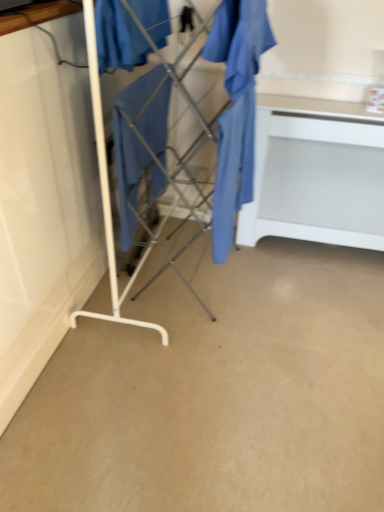
Question: Is the position of white matte table at center more distant than that of metal drying rack at center?

Choices:
 (A) no
 (B) yes

Answer: (B)

Question: Is white matte table at center facing away from metal drying rack at center?

Choices:
 (A) yes
 (B) no

Answer: (B)

Question: Considering the relative positions of white matte table at center and metal drying rack at center in the image provided, is white matte table at center in front of metal drying rack at center?

Choices:
 (A) no
 (B) yes

Answer: (A)

Question: Is white matte table at center wider than metal drying rack at center?

Choices:
 (A) yes
 (B) no

Answer: (B)

Question: From the image's perspective, is white matte table at center over metal drying rack at center?

Choices:
 (A) no
 (B) yes

Answer: (A)

Question: Considering the positions of white matte table at center and matte blue fabric at center, arranged as the 3th clothing when viewed from the right, in the image, is white matte table at center taller or shorter than matte blue fabric at center, arranged as the 3th clothing when viewed from the right,?

Choices:
 (A) short
 (B) tall

Answer: (B)

Question: Considering the positions of point (266, 99) and point (102, 23), is point (266, 99) closer or farther from the camera than point (102, 23)?

Choices:
 (A) closer
 (B) farther

Answer: (B)

Question: In the image, is white matte table at center positioned in front of or behind matte blue fabric at center, arranged as the 3th clothing when viewed from the right?

Choices:
 (A) front
 (B) behind

Answer: (B)

Question: From the image's perspective, relative to matte blue fabric at center, arranged as the 3th clothing when viewed from the right, is white matte table at center above or below?

Choices:
 (A) above
 (B) below

Answer: (B)

Question: From a real-world perspective, is matte blue fabric at center, arranged as the 3th clothing when viewed from the right, physically located above or below matte blue fabric at center, which is counted as the 2th clothing, starting from the left?

Choices:
 (A) above
 (B) below

Answer: (A)

Question: In the image, is matte blue fabric at center, the 1th clothing when ordered from left to right, on the left side or the right side of matte blue fabric at center, which is counted as the 2th clothing, starting from the left?

Choices:
 (A) right
 (B) left

Answer: (B)

Question: In terms of width, does matte blue fabric at center, arranged as the 3th clothing when viewed from the right, look wider or thinner when compared to matte blue fabric at center, which is counted as the 2th clothing, starting from the left?

Choices:
 (A) thin
 (B) wide

Answer: (B)

Question: Considering the positions of matte blue fabric at center, arranged as the 3th clothing when viewed from the right, and matte blue fabric at center, which is counted as the 2th clothing, starting from the left, in the image, is matte blue fabric at center, arranged as the 3th clothing when viewed from the right, taller or shorter than matte blue fabric at center, which is counted as the 2th clothing, starting from the left,?

Choices:
 (A) short
 (B) tall

Answer: (A)

Question: Is point (26, 477) closer or farther from the camera than point (302, 192)?

Choices:
 (A) farther
 (B) closer

Answer: (B)

Question: From the image's perspective, relative to white matte table at center, is beige carpet at center above or below?

Choices:
 (A) above
 (B) below

Answer: (B)